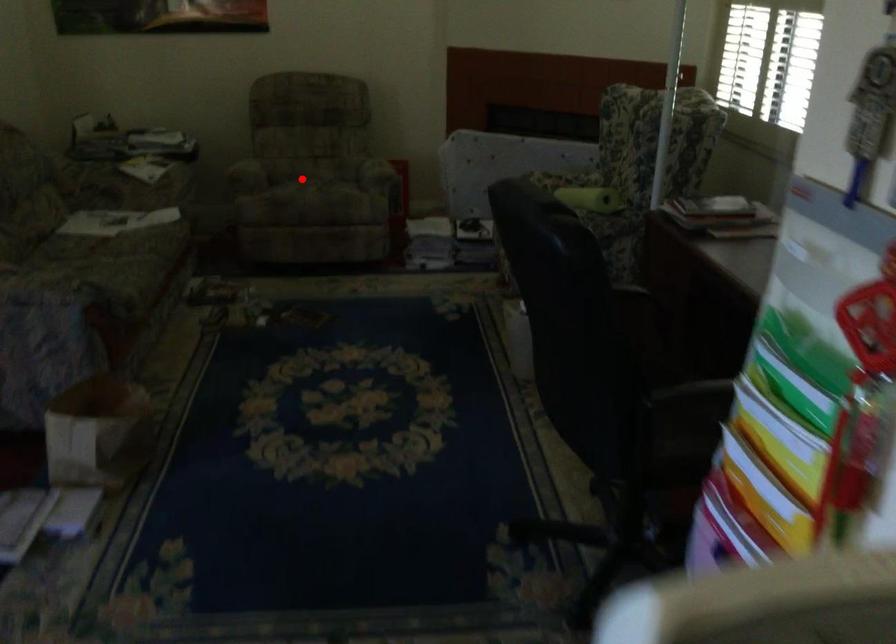
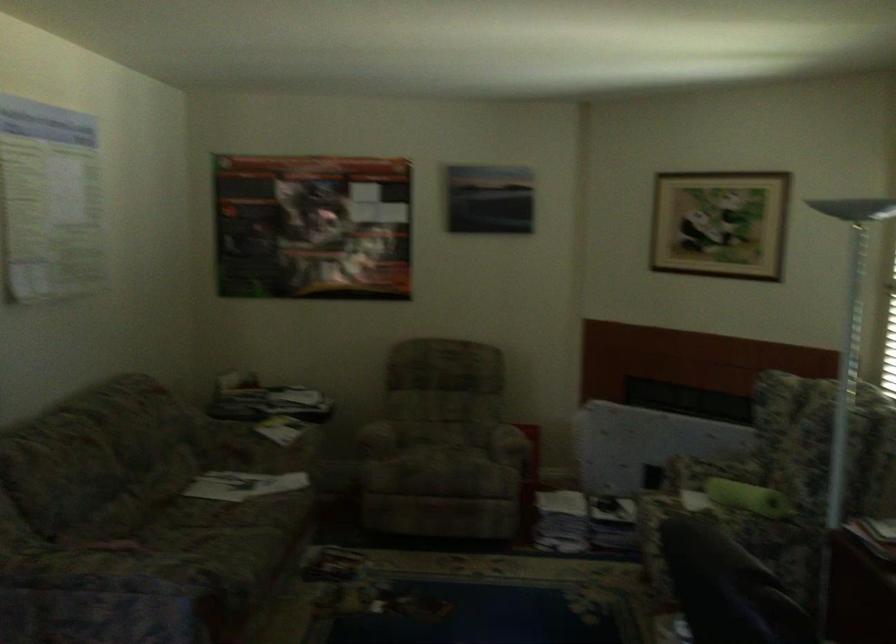
Locate, in the second image, the point that corresponds to the highlighted location in the first image.

(436, 451)